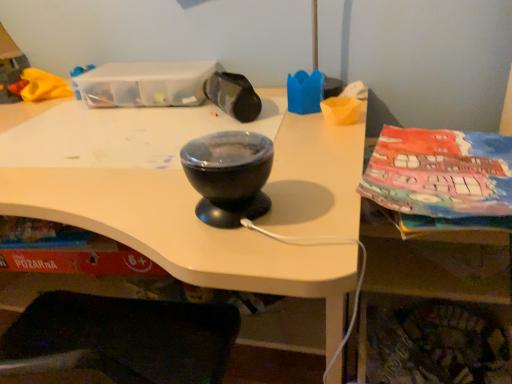
This screenshot has height=384, width=512. In order to click on matte black bowl at center in this screenshot , I will do `click(229, 176)`.

This screenshot has width=512, height=384. Describe the element at coordinates (229, 176) in the screenshot. I see `matte black bowl at center` at that location.

What do you see at coordinates (182, 234) in the screenshot? I see `black glossy bowl at center` at bounding box center [182, 234].

Find the location of a particular element. black glossy bowl at center is located at coordinates (182, 234).

Locate an element on the screen. matte black bowl at center is located at coordinates (229, 176).

Between black glossy bowl at center and matte black bowl at center, which one appears on the right side from the viewer's perspective?

matte black bowl at center is more to the right.

Looking at this image, considering their positions, is black glossy bowl at center located in front of or behind matte black bowl at center?

Clearly, black glossy bowl at center is in front of matte black bowl at center.

Considering the points (279, 272) and (229, 187), which point is behind, point (279, 272) or point (229, 187)?

The point (229, 187) is farther from the camera.

From the image's perspective, is black glossy bowl at center below matte black bowl at center?

Indeed, from the image's perspective, black glossy bowl at center is shown beneath matte black bowl at center.

From a real-world perspective, does black glossy bowl at center stand above matte black bowl at center?

Actually, black glossy bowl at center is physically below matte black bowl at center in the real world.

Which of these two, black glossy bowl at center or matte black bowl at center, is wider?

Wider between the two is black glossy bowl at center.

Is black glossy bowl at center taller or shorter than matte black bowl at center?

Considering their sizes, black glossy bowl at center has more height than matte black bowl at center.

Can you confirm if black glossy bowl at center is bigger than matte black bowl at center?

Yes.

Can we say black glossy bowl at center lies outside matte black bowl at center?

That's correct, black glossy bowl at center is outside of matte black bowl at center.

Would you consider black glossy bowl at center to be distant from matte black bowl at center?

black glossy bowl at center is actually quite close to matte black bowl at center.

Is black glossy bowl at center oriented towards matte black bowl at center?

No, black glossy bowl at center is not facing towards matte black bowl at center.

What's the angular difference between black glossy bowl at center and matte black bowl at center's facing directions?

The angle between the facing direction of black glossy bowl at center and the facing direction of matte black bowl at center is 162 degrees.

How distant is black glossy bowl at center from matte black bowl at center?

black glossy bowl at center and matte black bowl at center are 6.00 inches apart.

This screenshot has height=384, width=512. I want to click on basin to the right of black glossy bowl at center, so click(229, 176).

Between matte black bowl at center and black glossy bowl at center, which one appears on the right side from the viewer's perspective?

From the viewer's perspective, matte black bowl at center appears more on the right side.

Considering the positions of objects matte black bowl at center and black glossy bowl at center in the image provided, who is behind, matte black bowl at center or black glossy bowl at center?

matte black bowl at center.

Does point (217, 135) lie in front of point (294, 132)?

Yes.

From the image's perspective, relative to black glossy bowl at center, is matte black bowl at center above or below?

Based on their image positions, matte black bowl at center is located above black glossy bowl at center.

From a real-world perspective, who is located higher, matte black bowl at center or black glossy bowl at center?

matte black bowl at center, from a real-world perspective.

Is matte black bowl at center wider than black glossy bowl at center?

Incorrect, the width of matte black bowl at center does not surpass that of black glossy bowl at center.

From the picture: Considering the relative sizes of matte black bowl at center and black glossy bowl at center in the image provided, is matte black bowl at center shorter than black glossy bowl at center?

Indeed, matte black bowl at center has a lesser height compared to black glossy bowl at center.

Who is smaller, matte black bowl at center or black glossy bowl at center?

With smaller size is matte black bowl at center.

Is matte black bowl at center inside or outside of black glossy bowl at center?

matte black bowl at center lies outside black glossy bowl at center.

Is matte black bowl at center positioned far away from black glossy bowl at center?

matte black bowl at center is near black glossy bowl at center, not far away.

Does matte black bowl at center turn towards black glossy bowl at center?

No, matte black bowl at center is not facing towards black glossy bowl at center.

How different are the orientations of matte black bowl at center and black glossy bowl at center in degrees?

They differ by 162 degrees in their facing directions.

How far apart are matte black bowl at center and black glossy bowl at center?

matte black bowl at center and black glossy bowl at center are 15.25 centimeters apart from each other.

Find the location of a particular element. This screenshot has height=384, width=512. desk below the matte black bowl at center (from a real-world perspective) is located at coordinates (182, 234).

Where is `desk located on the left of matte black bowl at center`? The image size is (512, 384). desk located on the left of matte black bowl at center is located at coordinates (182, 234).

At what (x,y) coordinates should I click in order to perform the action: click on basin behind the black glossy bowl at center. Please return your answer as a coordinate pair (x, y). The image size is (512, 384). Looking at the image, I should click on (229, 176).